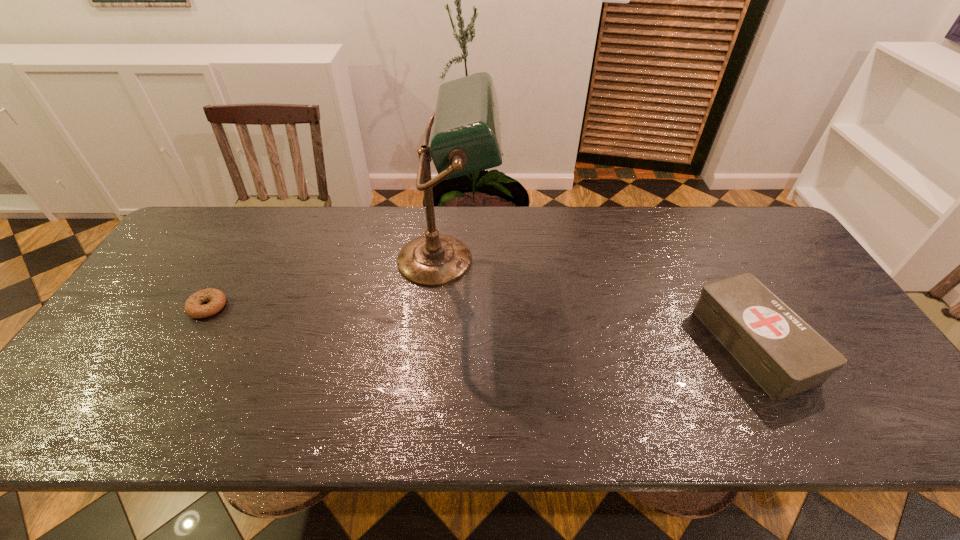
The height and width of the screenshot is (540, 960). I want to click on free space between the second tallest object and the tallest object, so click(600, 302).

This screenshot has height=540, width=960. Find the location of `empty space between the second object from left to right and the second shortest object`. empty space between the second object from left to right and the second shortest object is located at coordinates (600, 302).

At what (x,y) coordinates should I click in order to perform the action: click on free point between the tallest object and the rightmost object. Please return your answer as a coordinate pair (x, y). The height and width of the screenshot is (540, 960). Looking at the image, I should click on (600, 302).

Identify the location of free space that is in between the second tallest object and the shortest object. (480, 326).

The image size is (960, 540). In order to click on free point between the tallest object and the bagel in this screenshot , I will do `click(327, 283)`.

Locate an element on the screen. free space between the second shortest object and the shortest object is located at coordinates (480, 326).

Locate an element on the screen. free space that is in between the tallest object and the leftmost object is located at coordinates (327, 283).

Where is `blank region between the second object from left to right and the shortest object`? blank region between the second object from left to right and the shortest object is located at coordinates (327, 283).

Locate an element on the screen. the second closest object to the second shortest object is located at coordinates (216, 299).

Choose which object is the nearest neighbor to the rightmost object. Please provide its 2D coordinates. Your answer should be formatted as a tuple, i.e. [(x, y)], where the tuple contains the x and y coordinates of a point satisfying the conditions above.

[(466, 138)]